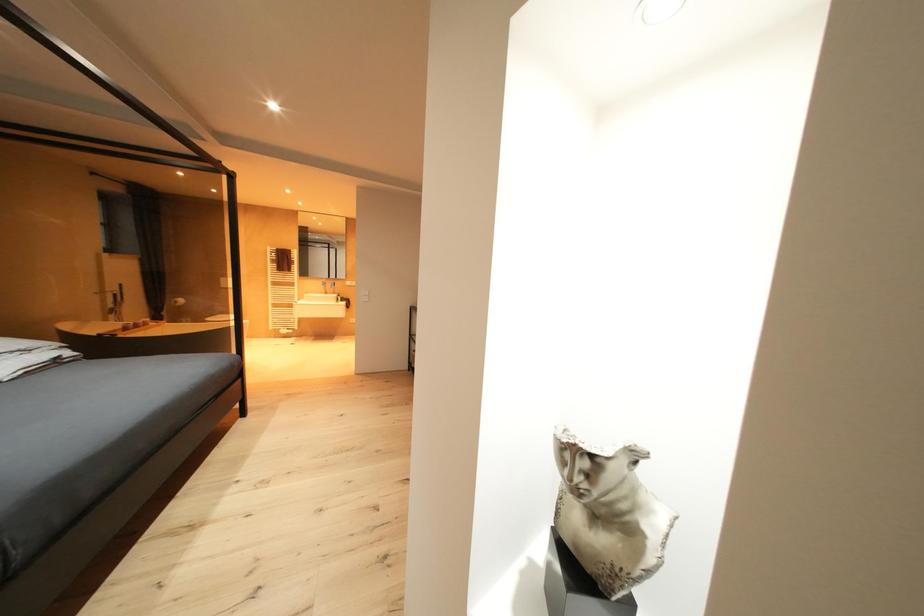
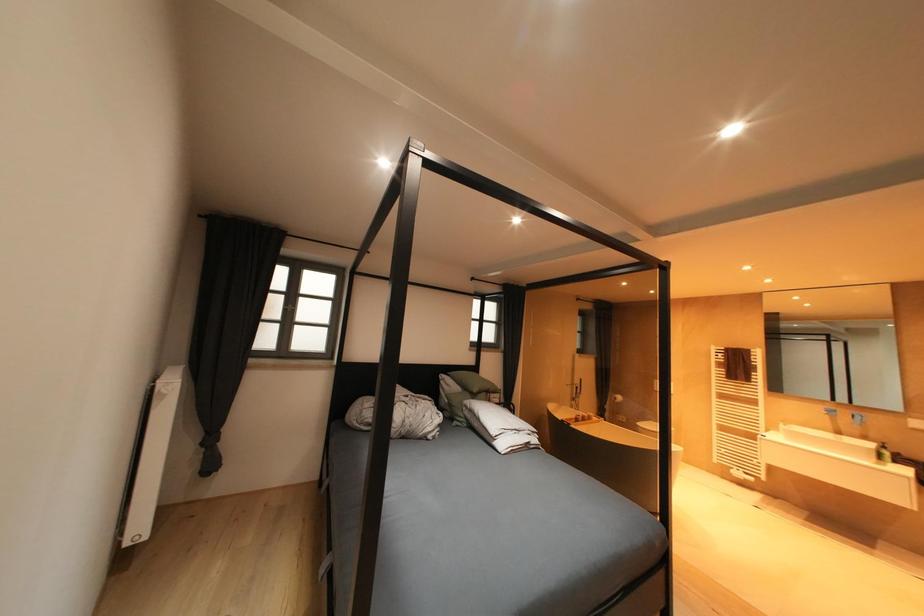
Question: The camera is either moving clockwise (left) or counter-clockwise (right) around the object. The first image is from the beginning of the video and the second image is from the end. Is the camera moving left or right when shooting the video?

Choices:
 (A) Left
 (B) Right

Answer: (B)